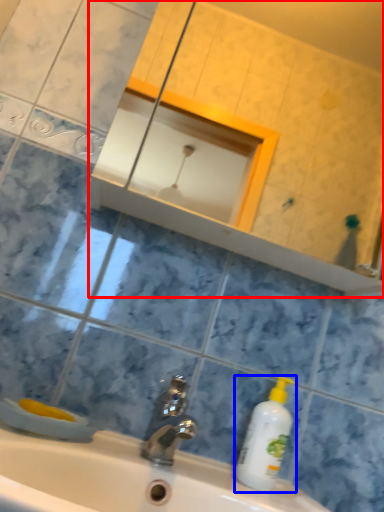
Question: Which object appears farthest to the camera in this image, mirror (highlighted by a red box) or cleaning product (highlighted by a blue box)?

Choices:
 (A) mirror
 (B) cleaning product

Answer: (B)